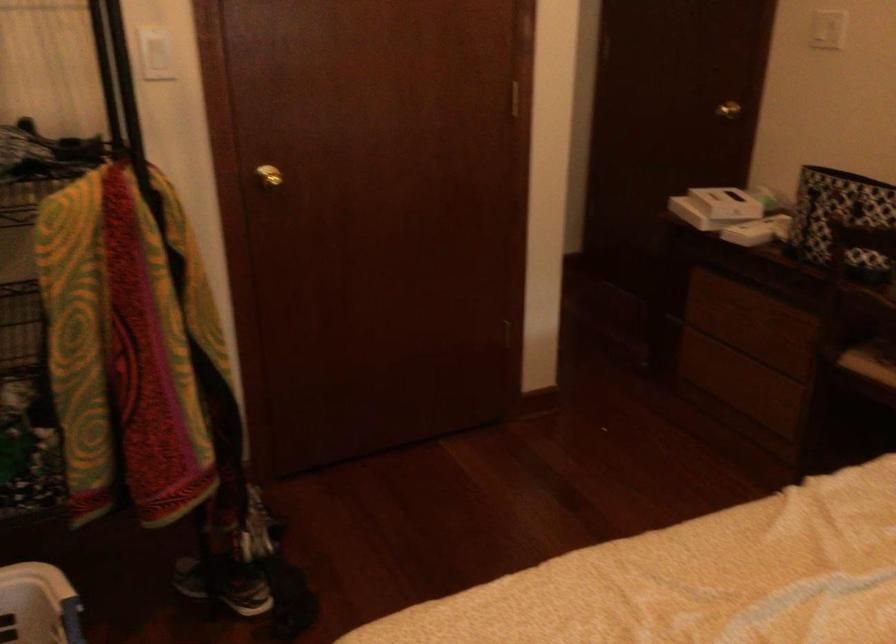
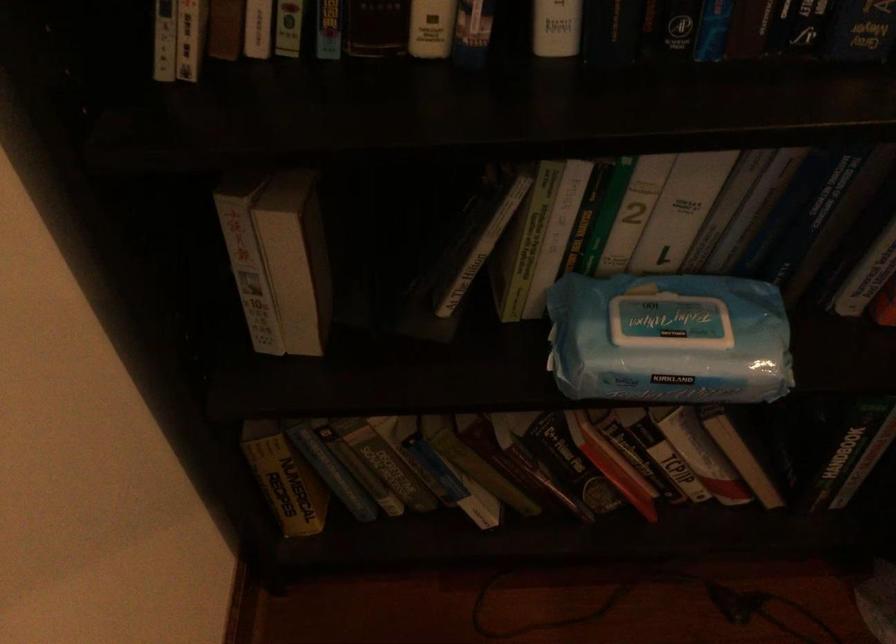
Based on the continuous images, in which direction is the camera rotating?

The camera rotated toward left-down.